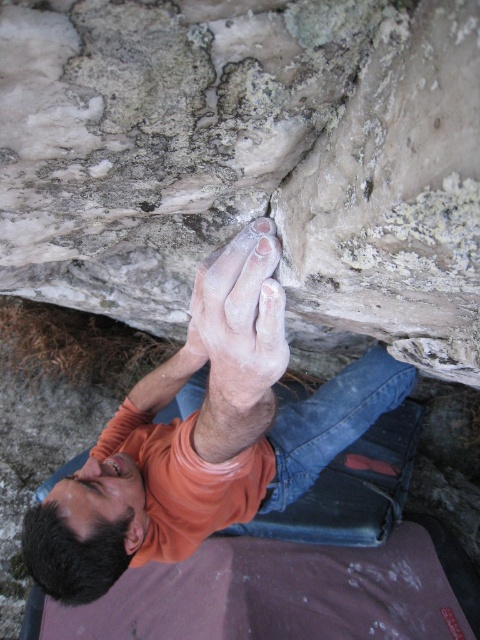
Can you confirm if smooth gray rock at center is positioned above dry skin at upper center?

Correct, smooth gray rock at center is located above dry skin at upper center.

Is point (192, 276) behind point (254, 429)?

Yes, it is behind point (254, 429).

Between point (171, 48) and point (181, 362), which one is positioned in front?

Positioned in front is point (171, 48).

Find the location of a particular element. This screenshot has width=480, height=640. smooth gray rock at center is located at coordinates click(250, 164).

Who is more forward, [179,355] or [264,337]?

Positioned in front is point [264,337].

What are the coordinates of `dry skin at upper center` in the screenshot? It's located at (204, 435).

Where is `dry skin at upper center`? dry skin at upper center is located at coordinates (204, 435).

Does smooth gray rock at center lie in front of white powdery hand at center?

Yes, smooth gray rock at center is closer to the viewer.

Is smooth gray rock at center shorter than white powdery hand at center?

Yes, smooth gray rock at center is shorter than white powdery hand at center.

This screenshot has width=480, height=640. What do you see at coordinates (250, 164) in the screenshot? I see `smooth gray rock at center` at bounding box center [250, 164].

Identify the location of smooth gray rock at center. (250, 164).